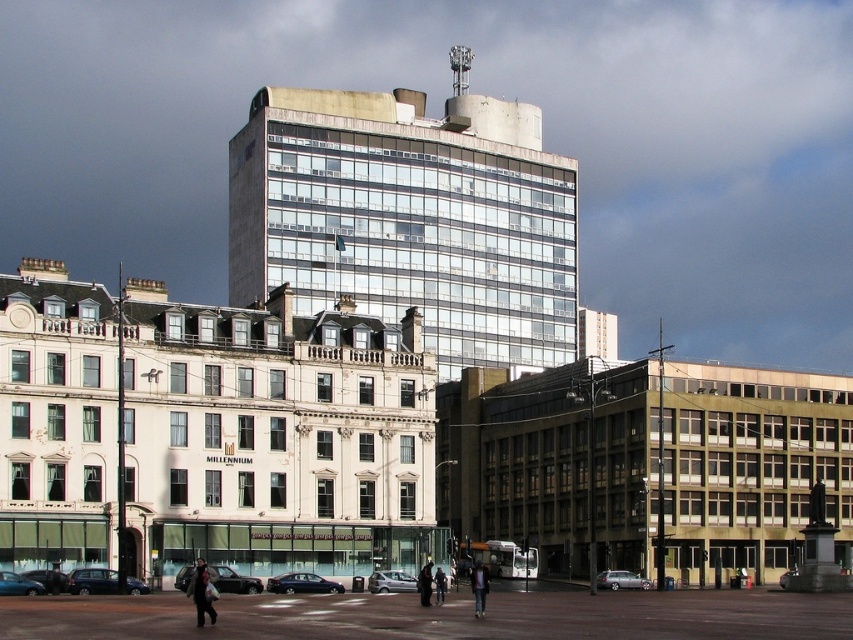
Does white stone building at center have a lesser width compared to clear glass building at center?

Correct, white stone building at center's width is less than clear glass building at center's.

Does white stone building at center have a greater height compared to clear glass building at center?

No, white stone building at center is not taller than clear glass building at center.

Measure the distance between point (9, 454) and camera.

They are 199.88 feet apart.

The width and height of the screenshot is (853, 640). What are the coordinates of `white stone building at center` in the screenshot? It's located at (209, 433).

Who is taller, white stone building at center or dark blue jeans at center?

white stone building at center is taller.

Does white stone building at center appear on the right side of dark blue jeans at center?

No, white stone building at center is not to the right of dark blue jeans at center.

Is point (30, 472) positioned in front of point (438, 576)?

No.

Where is `white stone building at center`? This screenshot has height=640, width=853. white stone building at center is located at coordinates (209, 433).

Can you confirm if clear glass building at center is wider than dark blue jeans at center?

Indeed, clear glass building at center has a greater width compared to dark blue jeans at center.

Based on the photo, who is lower down, clear glass building at center or dark blue jeans at center?

dark blue jeans at center

The height and width of the screenshot is (640, 853). Find the location of `clear glass building at center`. clear glass building at center is located at coordinates (410, 216).